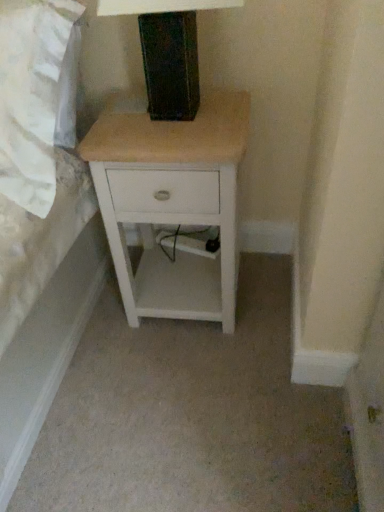
Where is `vacant space to the right of white wood nightstand at center`? The width and height of the screenshot is (384, 512). vacant space to the right of white wood nightstand at center is located at coordinates (268, 292).